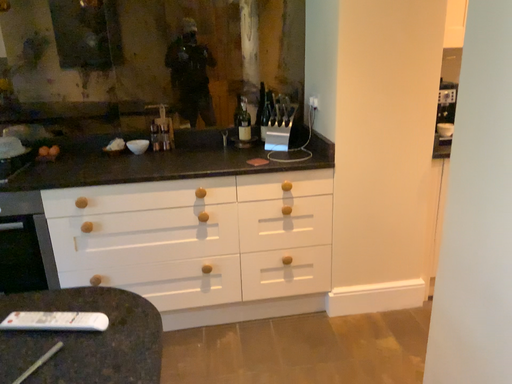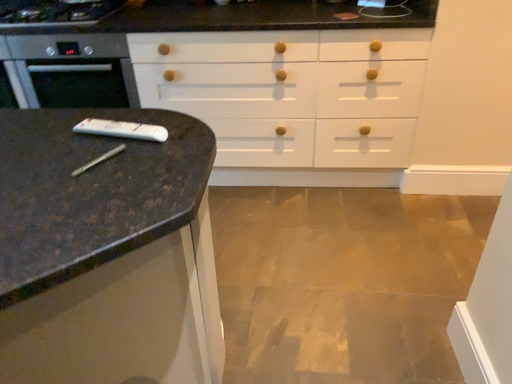
Question: How did the camera likely rotate when shooting the video?

Choices:
 (A) rotated left
 (B) rotated right

Answer: (A)